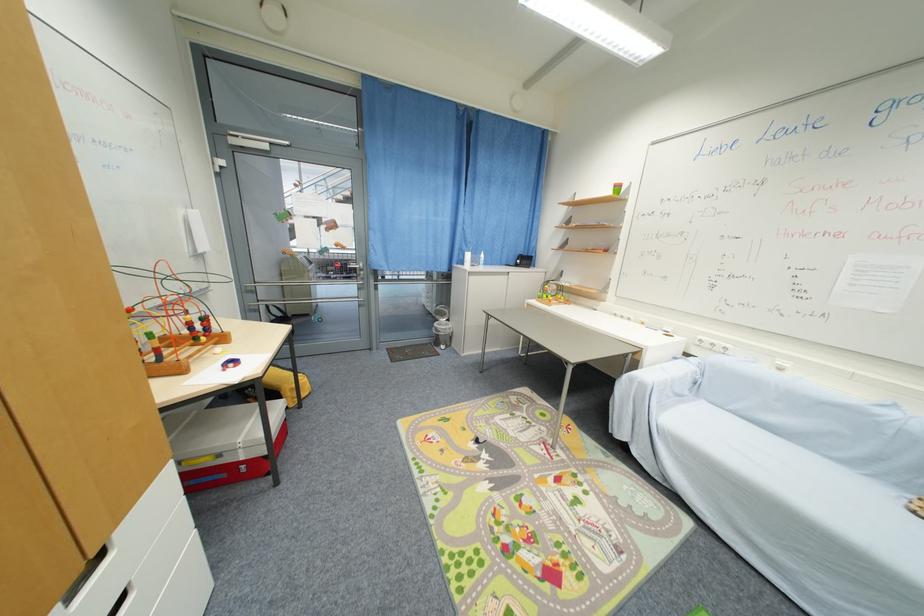
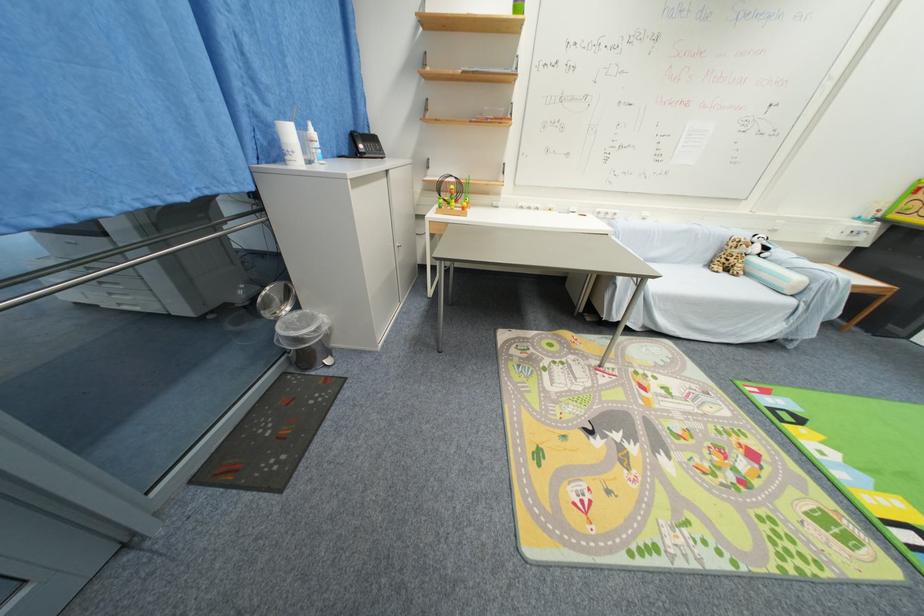
Find the pixel in the second image that matches [480,256] in the first image.

(306, 129)